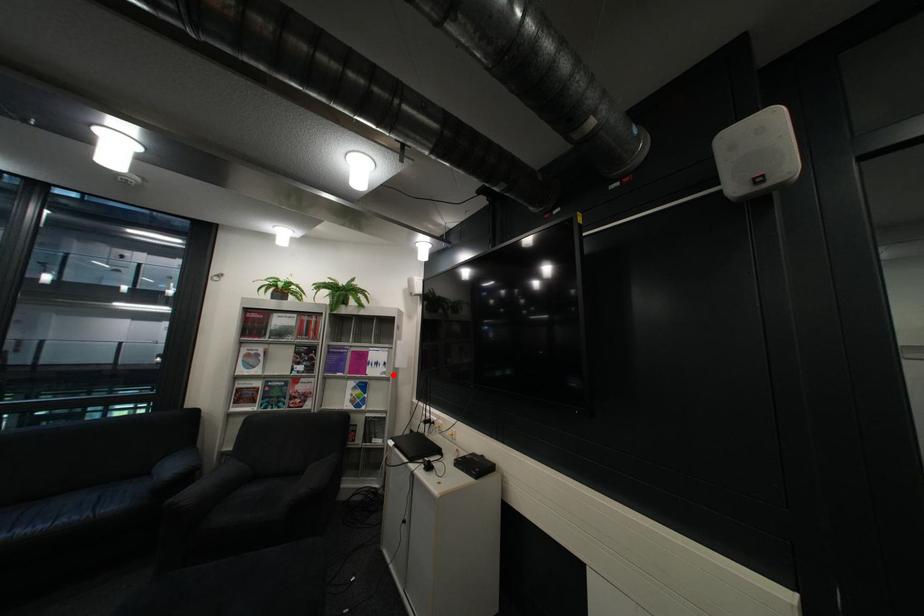
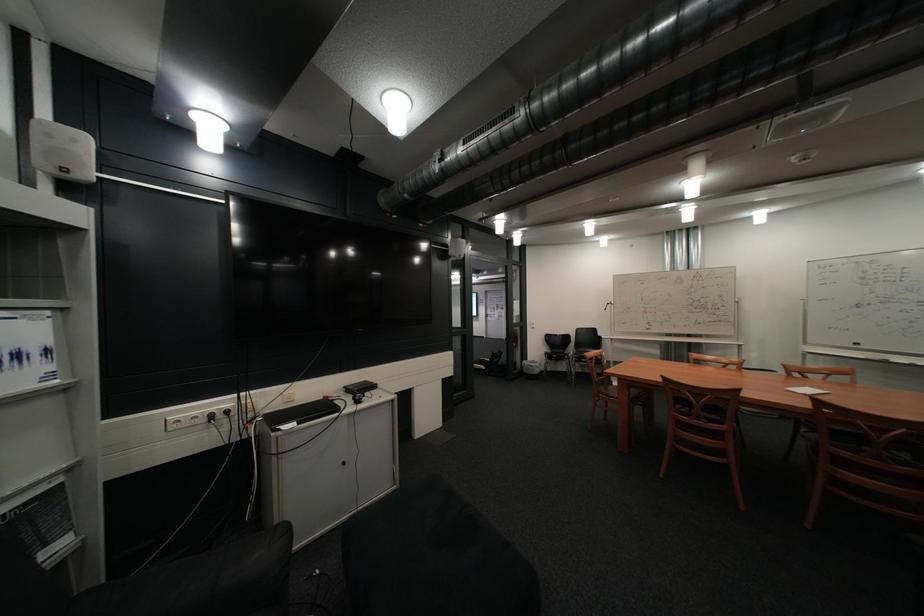
In the second image, find the point that corresponds to the highlighted location in the first image.

(46, 386)